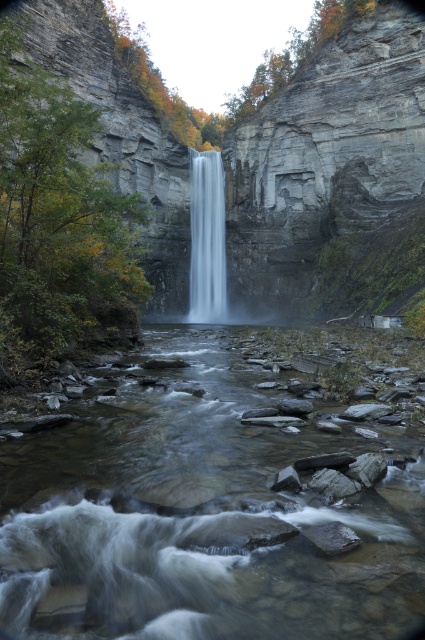
Question: Is clear water at center above white smooth waterfall at center?

Choices:
 (A) no
 (B) yes

Answer: (A)

Question: Can you confirm if clear water at center is thinner than white smooth waterfall at center?

Choices:
 (A) yes
 (B) no

Answer: (B)

Question: Where is clear water at center located in relation to white smooth waterfall at center in the image?

Choices:
 (A) left
 (B) right

Answer: (B)

Question: Which point appears farthest from the camera in this image?

Choices:
 (A) (198, 196)
 (B) (325, 522)

Answer: (A)